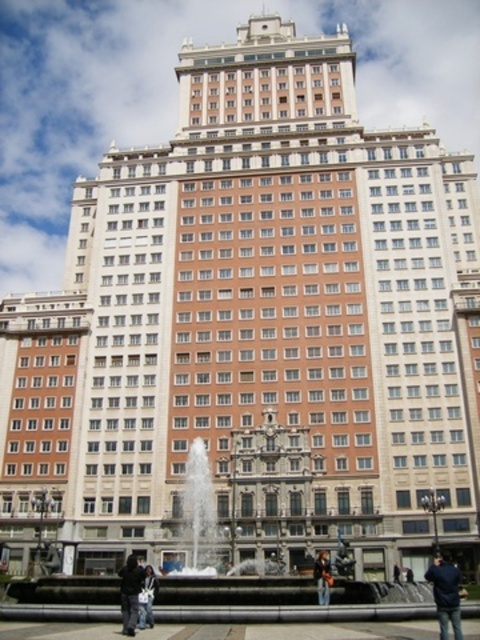
Question: Considering the relative positions of dark gray jacket at lower center and black leather jacket at lower center in the image provided, where is dark gray jacket at lower center located with respect to black leather jacket at lower center?

Choices:
 (A) below
 (B) above

Answer: (B)

Question: Among these points, which one is farthest from the camera?

Choices:
 (A) (136, 572)
 (B) (323, 586)
 (C) (219, 545)
 (D) (147, 625)

Answer: (C)

Question: Which object is positioned closest to the dark blue jacket at lower right?

Choices:
 (A) black leather jacket at lower center
 (B) dark gray jacket at lower center
 (C) denim jacket at lower center
 (D) dark blue jeans at lower center

Answer: (D)

Question: Does black leather jacket at lower center have a greater width compared to dark blue jeans at lower center?

Choices:
 (A) yes
 (B) no

Answer: (A)

Question: Can you confirm if dark gray jacket at lower center is positioned to the left of denim jacket at lower center?

Choices:
 (A) yes
 (B) no

Answer: (A)

Question: Which is farther from the dark blue jacket at lower right?

Choices:
 (A) denim jacket at lower center
 (B) dark gray jacket at lower center
 (C) white marble fountain at center
 (D) black leather jacket at lower center

Answer: (C)